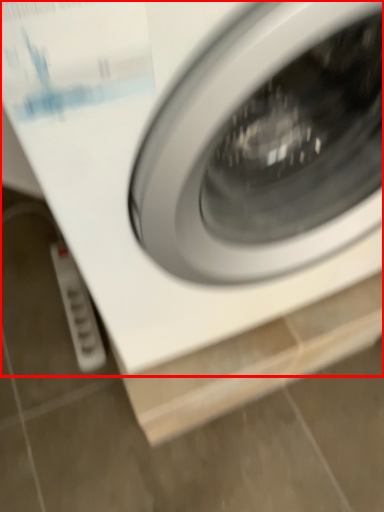
Question: From the image's perspective, what is the correct spatial relationship of washing machine (annotated by the red box) in relation to electric outlet?

Choices:
 (A) below
 (B) above

Answer: (B)